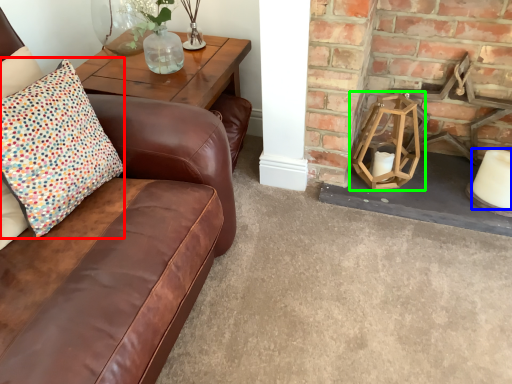
Question: Considering the real-world distances, which object is closest to pillow (highlighted by a red box)? candle (highlighted by a blue box) or candle holder (highlighted by a green box).

Choices:
 (A) candle
 (B) candle holder

Answer: (B)